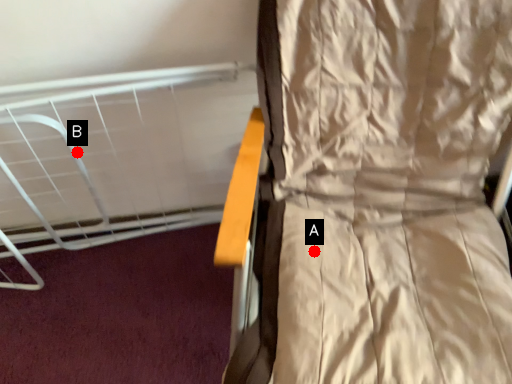
Question: Two points are circled on the image, labeled by A and B beside each circle. Which point is farther from the camera taking this photo?

Choices:
 (A) A is further
 (B) B is further

Answer: (B)